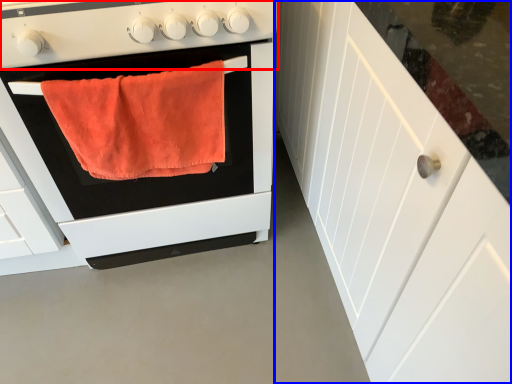
Question: Which object appears farthest to the camera in this image, gas stove (highlighted by a red box) or cabinetry (highlighted by a blue box)?

Choices:
 (A) gas stove
 (B) cabinetry

Answer: (A)